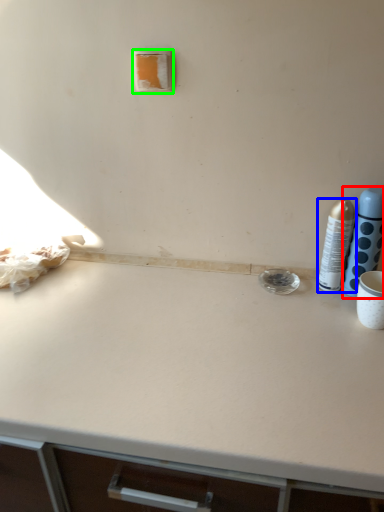
Question: Which object is the closest to the bottle (highlighted by a red box)? Choose among these: bottle (highlighted by a blue box) or light switch (highlighted by a green box).

Choices:
 (A) bottle
 (B) light switch

Answer: (A)